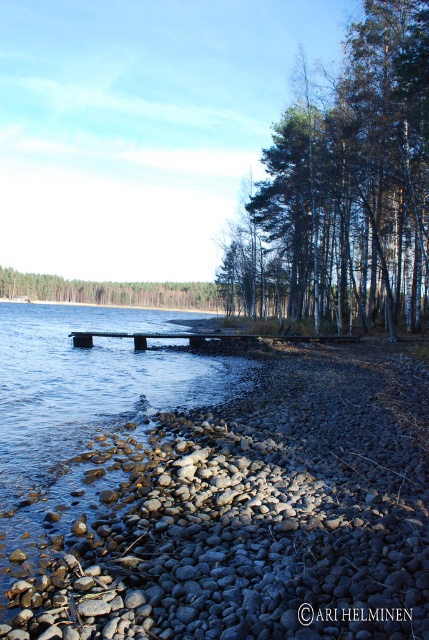
Question: Does green leafy trees at right have a lesser width compared to green leafy trees at center?

Choices:
 (A) no
 (B) yes

Answer: (B)

Question: Is gray smooth rocks at lower center positioned before wooden dock at center?

Choices:
 (A) no
 (B) yes

Answer: (B)

Question: Is green leafy trees at right bigger than wooden dock at center?

Choices:
 (A) no
 (B) yes

Answer: (B)

Question: Which object is positioned closest to the green leafy trees at center?

Choices:
 (A) wooden dock at center
 (B) green leafy trees at right

Answer: (B)

Question: Which object is closer to the camera taking this photo?

Choices:
 (A) wooden dock at center
 (B) green leafy trees at right
 (C) green leafy trees at center
 (D) gray smooth rocks at lower center

Answer: (D)

Question: Which object appears closest to the camera in this image?

Choices:
 (A) gray smooth rocks at lower center
 (B) green leafy trees at center
 (C) wooden dock at center

Answer: (A)